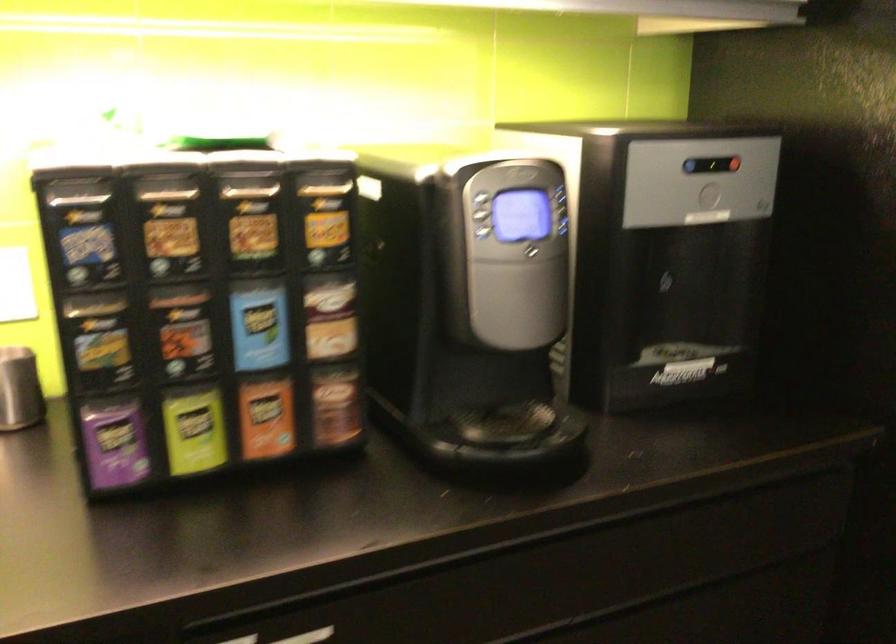
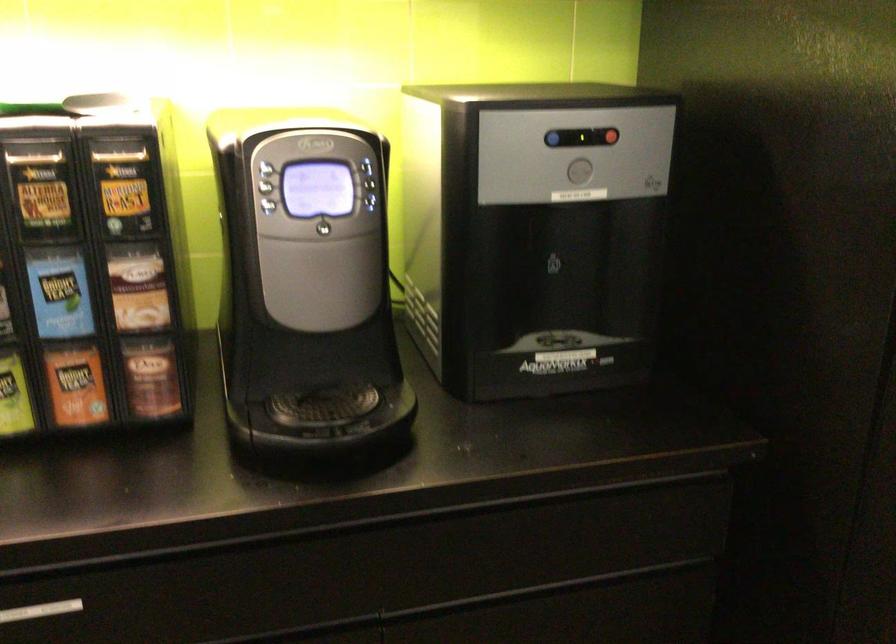
Where in the second image is the point corresponding to pixel 329 319 from the first image?

(138, 287)